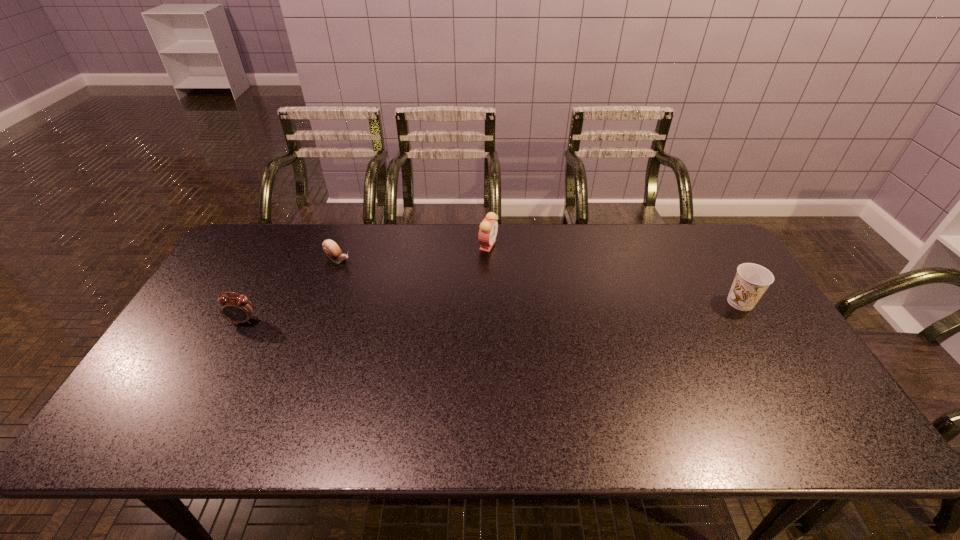
I want to click on free point at the far edge, so click(552, 242).

The width and height of the screenshot is (960, 540). In the image, there is a desktop. In order to click on vacant space at the near edge in this screenshot , I will do `click(271, 408)`.

At what (x,y) coordinates should I click in order to perform the action: click on vacant area at the right edge of the desktop. Please return your answer as a coordinate pair (x, y). The image size is (960, 540). Looking at the image, I should click on (719, 278).

What are the coordinates of `free space at the far left corner of the desktop` in the screenshot? It's located at (284, 226).

This screenshot has height=540, width=960. Identify the location of free location at the near left corner. (162, 396).

Find the location of `free space at the near right corner of the desktop`. free space at the near right corner of the desktop is located at coordinates (762, 409).

This screenshot has width=960, height=540. I want to click on free space between the second nearest object and the right alarm clock, so pyautogui.click(x=614, y=274).

Find the location of `vacant area that lies between the farther alarm clock and the left alarm clock`. vacant area that lies between the farther alarm clock and the left alarm clock is located at coordinates (366, 283).

Where is `vacant area that lies between the farther alarm clock and the leftmost object`? The image size is (960, 540). vacant area that lies between the farther alarm clock and the leftmost object is located at coordinates (366, 283).

In order to click on free space between the third farthest object and the left alarm clock in this screenshot , I will do `click(492, 312)`.